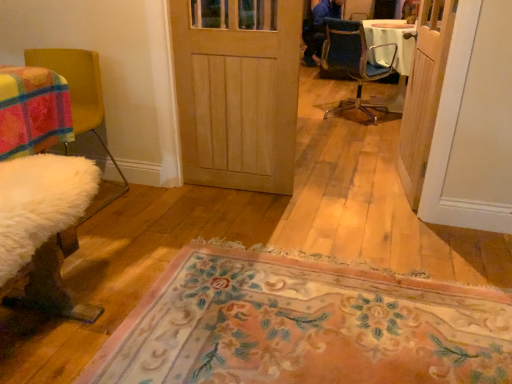
What is the approximate width of blue fabric chair at center, which appears as the second chair when ordered from the bottom?

blue fabric chair at center, which appears as the second chair when ordered from the bottom, is 17.64 inches in width.

At what (x,y) coordinates should I click in order to perform the action: click on blue fabric chair at center, the 1th chair viewed from the right. Please return your answer as a coordinate pair (x, y). The image size is (512, 384). Looking at the image, I should click on (354, 62).

Image resolution: width=512 pixels, height=384 pixels. What do you see at coordinates (424, 93) in the screenshot? I see `wooden door at right, which appears as the 2th door when viewed from the left` at bounding box center [424, 93].

Find the location of a particular element. blue fabric chair at center, the 1th chair positioned from the back is located at coordinates (354, 62).

From the white fluffy chair at left, which is the second chair from top to bottom, count 2nd doors backward and point to it. Please provide its 2D coordinates.

[(237, 91)]

Considering the relative sizes of white fluffy chair at left, arranged as the second chair when viewed from the back, and natural wood door at center, positioned as the first door in left-to-right order, in the image provided, is white fluffy chair at left, arranged as the second chair when viewed from the back, smaller than natural wood door at center, positioned as the first door in left-to-right order,?

No, white fluffy chair at left, arranged as the second chair when viewed from the back, is not smaller than natural wood door at center, positioned as the first door in left-to-right order.

From the image's perspective, which one is positioned higher, white fluffy chair at left, which is counted as the second chair, starting from the right, or natural wood door at center, which appears as the second door when viewed from the right?

natural wood door at center, which appears as the second door when viewed from the right, appears higher in the image.

Is white fluffy chair at left, which is counted as the second chair, starting from the right, positioned before natural wood door at center, which appears as the second door when viewed from the right?

Yes, white fluffy chair at left, which is counted as the second chair, starting from the right, is closer to the viewer.

Considering the sizes of objects wooden door at right, placed as the 1th door when sorted from right to left, and floral carpet at center in the image provided, who is bigger, wooden door at right, placed as the 1th door when sorted from right to left, or floral carpet at center?

Bigger between the two is floral carpet at center.

Which object is wider, wooden door at right, which appears as the 2th door when viewed from the left, or floral carpet at center?

floral carpet at center is wider.

From a real-world perspective, is wooden door at right, which appears as the 2th door when viewed from the left, located higher than floral carpet at center?

Correct, in the physical world, wooden door at right, which appears as the 2th door when viewed from the left, is higher than floral carpet at center.

Is wooden door at right, placed as the 1th door when sorted from right to left, not inside floral carpet at center?

That's correct, wooden door at right, placed as the 1th door when sorted from right to left, is outside of floral carpet at center.

Is wooden door at right, which appears as the 2th door when viewed from the left, positioned with its back to white fluffy chair at left, which is counted as the second chair, starting from the right?

No, wooden door at right, which appears as the 2th door when viewed from the left, is not facing the opposite direction of white fluffy chair at left, which is counted as the second chair, starting from the right.

Does wooden door at right, placed as the 1th door when sorted from right to left, have a lesser width compared to white fluffy chair at left, which appears as the first chair when ordered from the bottom?

Correct, the width of wooden door at right, placed as the 1th door when sorted from right to left, is less than that of white fluffy chair at left, which appears as the first chair when ordered from the bottom.

From the image's perspective, between wooden door at right, placed as the 1th door when sorted from right to left, and white fluffy chair at left, the first chair viewed from the left, who is located below?

white fluffy chair at left, the first chair viewed from the left, appears lower in the image.

Considering the positions of objects wooden door at right, placed as the 1th door when sorted from right to left, and white fluffy chair at left, the first chair viewed from the left, in the image provided, who is more to the right, wooden door at right, placed as the 1th door when sorted from right to left, or white fluffy chair at left, the first chair viewed from the left,?

From the viewer's perspective, wooden door at right, placed as the 1th door when sorted from right to left, appears more on the right side.

Identify the location of mat that appears below the natural wood door at center, positioned as the first door in left-to-right order (from the image's perspective). (304, 325).

What's the angular difference between natural wood door at center, which appears as the second door when viewed from the right, and floral carpet at center's facing directions?

There is a 179-degree angle between the facing directions of natural wood door at center, which appears as the second door when viewed from the right, and floral carpet at center.

Could you tell me if natural wood door at center, which appears as the second door when viewed from the right, is facing floral carpet at center?

Yes, natural wood door at center, which appears as the second door when viewed from the right, is turned towards floral carpet at center.

From a real-world perspective, is floral carpet at center physically located above or below natural wood door at center, which appears as the second door when viewed from the right?

Clearly, from a real-world perspective, floral carpet at center is below natural wood door at center, which appears as the second door when viewed from the right.

From the picture: Is floral carpet at center positioned with its back to natural wood door at center, positioned as the first door in left-to-right order?

floral carpet at center does not have its back to natural wood door at center, positioned as the first door in left-to-right order.

Which of these two, floral carpet at center or natural wood door at center, positioned as the first door in left-to-right order, stands shorter?

Standing shorter between the two is floral carpet at center.

Is point (226, 304) behind point (247, 176)?

No, (226, 304) is in front of (247, 176).

Considering the relative positions of natural wood door at center, which appears as the second door when viewed from the right, and wooden door at right, placed as the 1th door when sorted from right to left, in the image provided, is natural wood door at center, which appears as the second door when viewed from the right, behind wooden door at right, placed as the 1th door when sorted from right to left,?

Yes, natural wood door at center, which appears as the second door when viewed from the right, is further from the viewer.

Is natural wood door at center, positioned as the first door in left-to-right order, not within wooden door at right, placed as the 1th door when sorted from right to left?

Yes.

From a real-world perspective, is natural wood door at center, positioned as the first door in left-to-right order, physically above wooden door at right, placed as the 1th door when sorted from right to left?

No.

Does natural wood door at center, positioned as the first door in left-to-right order, lie behind blue fabric chair at center, which appears as the second chair when ordered from the bottom?

No, it is not.

Between natural wood door at center, which appears as the second door when viewed from the right, and blue fabric chair at center, the 1th chair from the top, which one appears on the left side from the viewer's perspective?

natural wood door at center, which appears as the second door when viewed from the right, is more to the left.

Who is shorter, natural wood door at center, which appears as the second door when viewed from the right, or blue fabric chair at center, marked as the 2th chair in a left-to-right arrangement?

blue fabric chair at center, marked as the 2th chair in a left-to-right arrangement, is shorter.

In the scene shown: From the image's perspective, between natural wood door at center, which appears as the second door when viewed from the right, and blue fabric chair at center, marked as the 2th chair in a left-to-right arrangement, who is located below?

natural wood door at center, which appears as the second door when viewed from the right.

The width and height of the screenshot is (512, 384). I want to click on the 2nd door behind the white fluffy chair at left, which appears as the first chair when ordered from the bottom, starting your count from the anchor, so click(237, 91).

I want to click on the 2nd door above the floral carpet at center (from the image's perspective), so click(x=424, y=93).

Considering their positions, is wooden door at right, which appears as the 2th door when viewed from the left, positioned further to natural wood door at center, which appears as the second door when viewed from the right, than blue fabric chair at center, which appears as the second chair when ordered from the bottom?

blue fabric chair at center, which appears as the second chair when ordered from the bottom, lies further to natural wood door at center, which appears as the second door when viewed from the right, than the other object.

Based on their spatial positions, is natural wood door at center, which appears as the second door when viewed from the right, or white fluffy chair at left, which is counted as the second chair, starting from the right, closer to wooden door at right, which appears as the 2th door when viewed from the left?

Based on the image, natural wood door at center, which appears as the second door when viewed from the right, appears to be nearer to wooden door at right, which appears as the 2th door when viewed from the left.

Estimate the real-world distances between objects in this image. Which object is closer to floral carpet at center, natural wood door at center, positioned as the first door in left-to-right order, or white fluffy chair at left, the first chair when ordered from front to back?

Result: Among the two, natural wood door at center, positioned as the first door in left-to-right order, is located nearer to floral carpet at center.

Estimate the real-world distances between objects in this image. Which object is further from blue fabric chair at center, marked as the 2th chair in a left-to-right arrangement, floral carpet at center or natural wood door at center, which appears as the second door when viewed from the right?

The object further to blue fabric chair at center, marked as the 2th chair in a left-to-right arrangement, is floral carpet at center.

Considering their positions, is wooden door at right, which appears as the 2th door when viewed from the left, positioned further to blue fabric chair at center, which appears as the second chair when ordered from the bottom, than natural wood door at center, positioned as the first door in left-to-right order?

Based on the image, natural wood door at center, positioned as the first door in left-to-right order, appears to be further to blue fabric chair at center, which appears as the second chair when ordered from the bottom.

Based on the photo, considering their positions, is white fluffy chair at left, which is counted as the second chair, starting from the right, positioned closer to blue fabric chair at center, the 1th chair viewed from the right, than wooden door at right, which appears as the 2th door when viewed from the left?

wooden door at right, which appears as the 2th door when viewed from the left.

Based on their spatial positions, is blue fabric chair at center, the 1th chair viewed from the right, or wooden door at right, which appears as the 2th door when viewed from the left, further from natural wood door at center, positioned as the first door in left-to-right order?

blue fabric chair at center, the 1th chair viewed from the right, lies further to natural wood door at center, positioned as the first door in left-to-right order, than the other object.

When comparing their distances from blue fabric chair at center, marked as the 2th chair in a left-to-right arrangement, does floral carpet at center or wooden door at right, which appears as the 2th door when viewed from the left, seem further?

Based on the image, floral carpet at center appears to be further to blue fabric chair at center, marked as the 2th chair in a left-to-right arrangement.

Find the location of a particular element. This screenshot has height=384, width=512. chair between white fluffy chair at left, which appears as the first chair when ordered from the bottom, and wooden door at right, which appears as the 2th door when viewed from the left, from left to right is located at coordinates (354, 62).

Identify the location of mat between white fluffy chair at left, arranged as the second chair when viewed from the back, and wooden door at right, placed as the 1th door when sorted from right to left, in the horizontal direction. (304, 325).

Locate an element on the screen. The width and height of the screenshot is (512, 384). door positioned between floral carpet at center and natural wood door at center, which appears as the second door when viewed from the right, from near to far is located at coordinates (424, 93).

Identify the location of door between white fluffy chair at left, which is the second chair from top to bottom, and floral carpet at center from left to right. (237, 91).